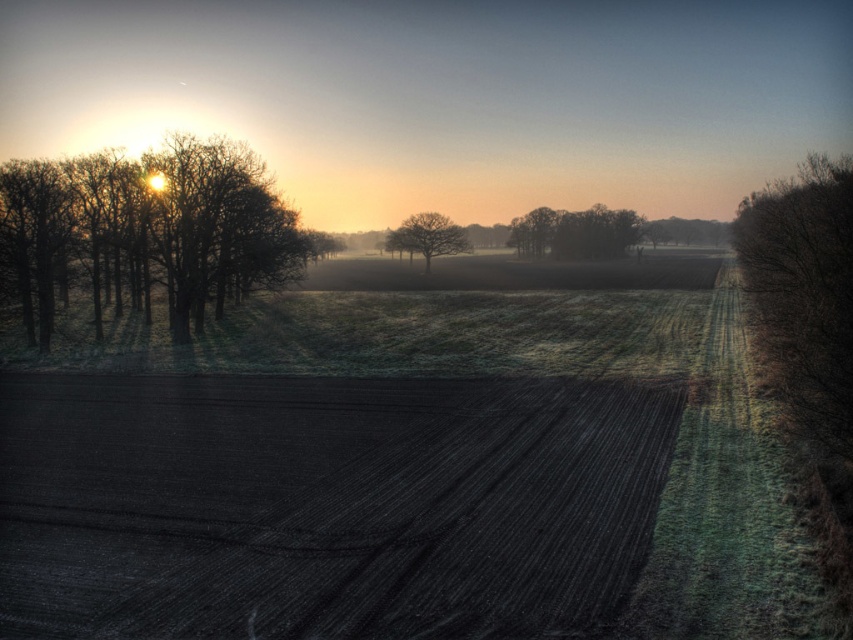
Question: Does brown matte tree at right appear under dark green textured trees at center?

Choices:
 (A) no
 (B) yes

Answer: (B)

Question: Which object is farther from the camera taking this photo?

Choices:
 (A) brown matte tree at right
 (B) smooth brown tree at center
 (C) brown matte trees at left

Answer: (B)

Question: Which point is farther from the camera taking this photo?

Choices:
 (A) (457, 250)
 (B) (595, 205)
 (C) (827, 259)

Answer: (B)

Question: Can you confirm if brown matte trees at left is positioned to the right of smooth brown tree at center?

Choices:
 (A) no
 (B) yes

Answer: (A)

Question: Where is brown matte tree at right located in relation to smooth brown tree at center in the image?

Choices:
 (A) above
 (B) below

Answer: (A)

Question: Which object is the farthest from the brown matte trees at left?

Choices:
 (A) brown matte tree at right
 (B) dark green textured trees at center
 (C) smooth brown tree at center

Answer: (B)